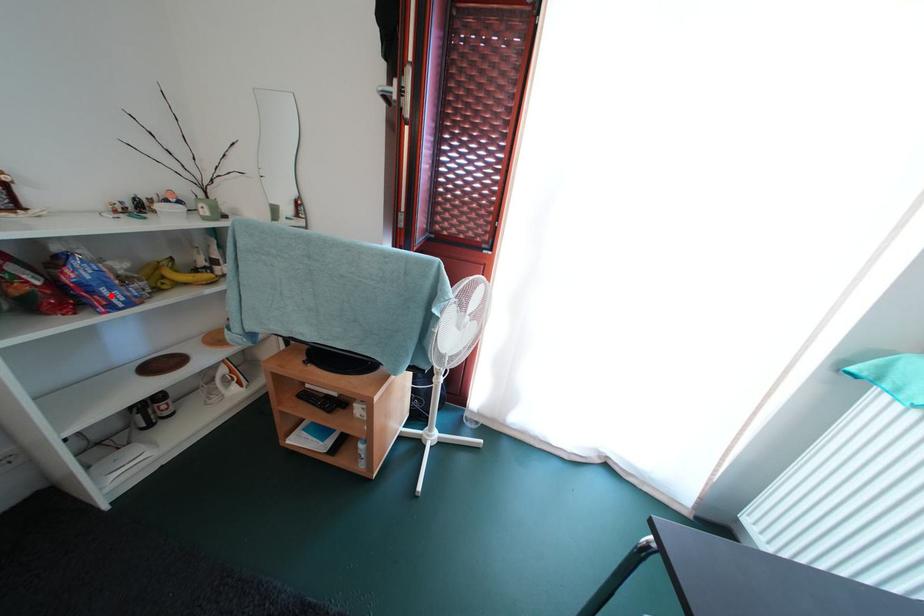
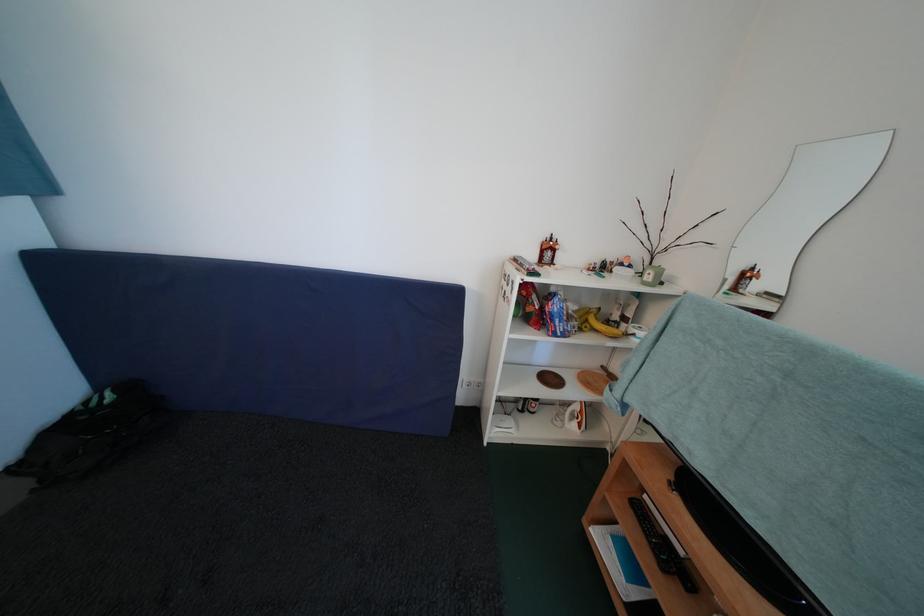
Question: I am providing you with two images of the same scene from different viewpoints. A red point is marked on the first image. Can you still see the location of the red point in image 2?

Choices:
 (A) Yes
 (B) No

Answer: (A)